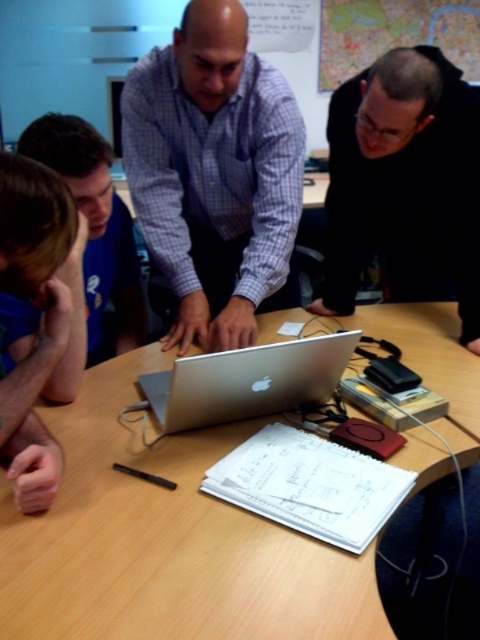
Between matte purple shirt at center and blue shirt at left, which one appears on the left side from the viewer's perspective?

blue shirt at left is more to the left.

Does matte purple shirt at center have a greater height compared to blue shirt at left?

Yes.

Identify the location of matte purple shirt at center. The height and width of the screenshot is (640, 480). (215, 173).

Between point (33, 637) and point (111, 282), which one is positioned in front?

Point (33, 637) is more forward.

Does wooden table at center appear under blue shirt at left?

Indeed, wooden table at center is positioned under blue shirt at left.

Where is `wooden table at center`? This screenshot has width=480, height=640. wooden table at center is located at coordinates (165, 541).

Does black matte jacket at upper right appear on the right side of brown hair at left?

Correct, you'll find black matte jacket at upper right to the right of brown hair at left.

Does point (400, 260) come in front of point (49, 460)?

No, it is not.

Which is in front, point (397, 51) or point (46, 493)?

Point (46, 493) is in front.

You are a GUI agent. You are given a task and a screenshot of the screen. Output one action in this format:
    pyautogui.click(x=<x>, y=<y>)
    Task: Click on the black matte jacket at upper right
    
    Given the screenshot: What is the action you would take?
    pyautogui.click(x=405, y=184)